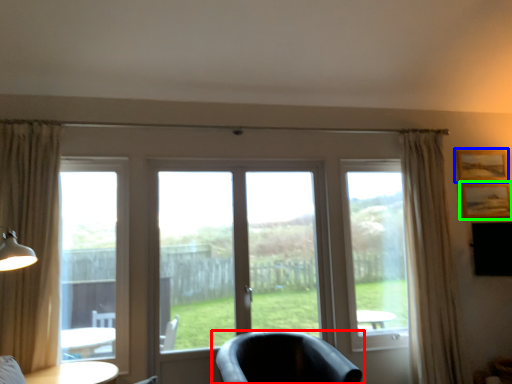
Question: Which object is positioned closest to chair (highlighted by a red box)? Select from picture frame (highlighted by a blue box) and picture frame (highlighted by a green box).

Choices:
 (A) picture frame
 (B) picture frame

Answer: (B)